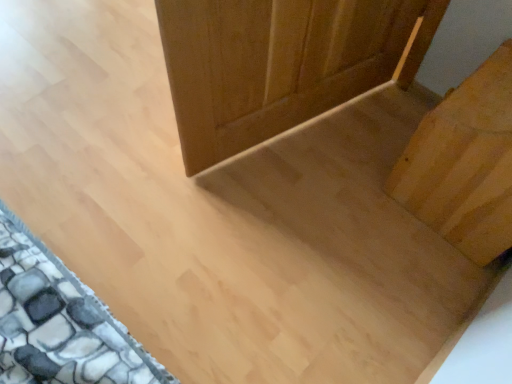
Measure the distance between natural wood door at lower right and camera.

A distance of 3.44 feet exists between natural wood door at lower right and camera.

What do you see at coordinates (464, 163) in the screenshot?
I see `natural wood door at lower right` at bounding box center [464, 163].

Image resolution: width=512 pixels, height=384 pixels. In order to click on natural wood door at lower right in this screenshot , I will do `click(464, 163)`.

Find the location of a particular element. natural wood door at lower right is located at coordinates (464, 163).